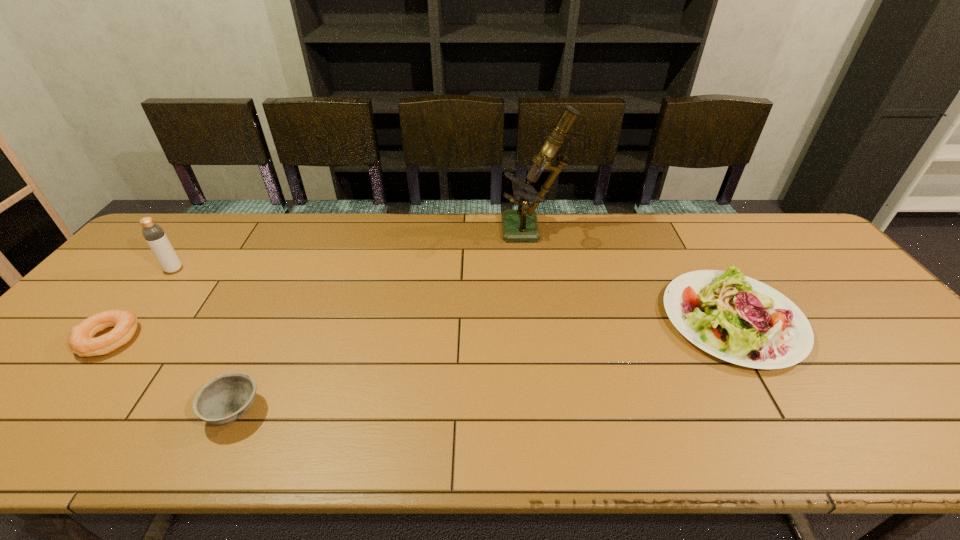
You are a GUI agent. You are given a task and a screenshot of the screen. Output one action in this format:
    pyautogui.click(x=<x>, y=<y>)
    Task: Click on the second object from right to left
    The image size is (960, 540).
    Given the screenshot: What is the action you would take?
    (x=521, y=224)

This screenshot has width=960, height=540. Find the location of `microscope`. microscope is located at coordinates (521, 224).

The image size is (960, 540). I want to click on the second tallest object, so click(154, 235).

Identify the location of bottle. The image size is (960, 540). (154, 235).

This screenshot has height=540, width=960. Find the location of `salad plate`. salad plate is located at coordinates (736, 318).

The width and height of the screenshot is (960, 540). I want to click on the third tallest object, so click(736, 318).

The image size is (960, 540). In order to click on bowl in this screenshot , I will do `click(227, 397)`.

Image resolution: width=960 pixels, height=540 pixels. In order to click on the nearest object in this screenshot , I will do `click(227, 397)`.

Where is `the shortest object`? the shortest object is located at coordinates (81, 341).

This screenshot has height=540, width=960. I want to click on vacant space located 0.270m at the eyepiece of the fourth object from left to right, so click(420, 231).